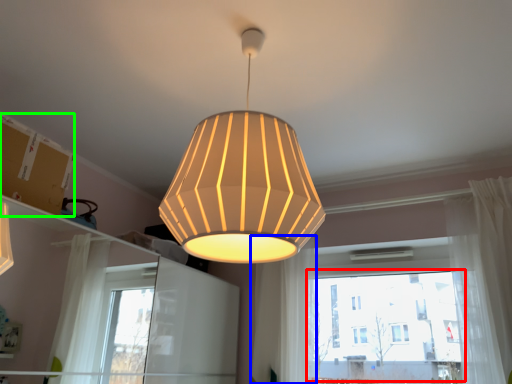
Question: Which object is positioned closest to bay window (highlighted by a red box)? Select from curtain (highlighted by a blue box) and cardboard box (highlighted by a green box).

Choices:
 (A) curtain
 (B) cardboard box

Answer: (A)